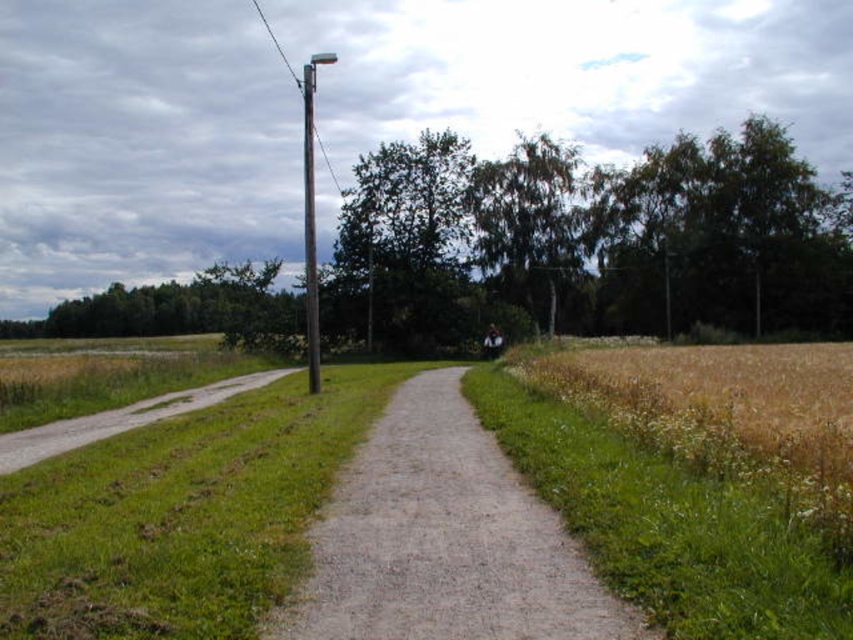
Is green grass at right in front of gravel path at lower left?

Yes, it is.

Between green grass at right and gravel path at lower left, which one has less height?

gravel path at lower left

Is point (635, 534) more distant than point (115, 410)?

No.

You are a GUI agent. You are given a task and a screenshot of the screen. Output one action in this format:
    pyautogui.click(x=<x>, y=<y>)
    Task: Click on the green grass at right
    
    Given the screenshot: What is the action you would take?
    pyautogui.click(x=665, y=525)

Does point (811, 588) lie behind point (309, 208)?

No, (811, 588) is in front of (309, 208).

Where is `green grass at right`? This screenshot has height=640, width=853. green grass at right is located at coordinates [665, 525].

Between gravel path at center and brown wooden telegraph pole at upper center, which one is positioned higher?

brown wooden telegraph pole at upper center

Can you confirm if gravel path at center is shorter than brown wooden telegraph pole at upper center?

Indeed, gravel path at center has a lesser height compared to brown wooden telegraph pole at upper center.

Identify the location of gravel path at center. The image size is (853, 640). (444, 540).